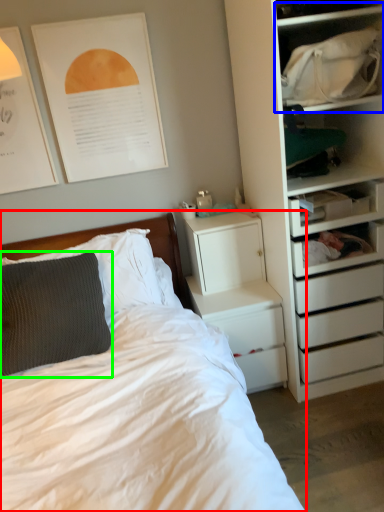
Question: Which object is positioned farthest from bed (highlighted by a red box)? Select from cabinet (highlighted by a blue box) and pillow (highlighted by a green box).

Choices:
 (A) cabinet
 (B) pillow

Answer: (A)